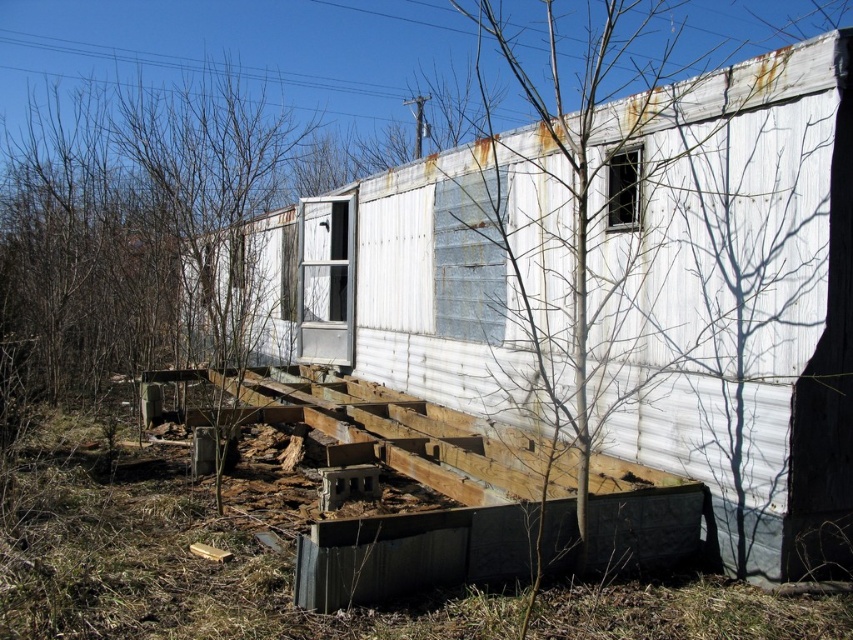
Is rusty corrugated metal shed at center above bare wood tree at center?

No.

Between point (540, 163) and point (485, 10), which one is positioned in front?

Positioned in front is point (485, 10).

Does point (430, 378) come farther from viewer compared to point (519, 282)?

Yes.

Locate an element on the screen. rusty corrugated metal shed at center is located at coordinates (732, 296).

Is metallic gray foundation at lower center positioned in front of bare wood tree at center?

No, it is behind bare wood tree at center.

Is point (437, 560) behind point (566, 128)?

No, it is in front of (566, 128).

Where is `metallic gray foundation at lower center`? The image size is (853, 640). metallic gray foundation at lower center is located at coordinates (413, 554).

Who is more forward, (686,404) or (531,541)?

Point (531,541) is in front.

Is rusty corrugated metal shed at center taller than metallic gray foundation at lower center?

Correct, rusty corrugated metal shed at center is much taller as metallic gray foundation at lower center.

Is point (643, 204) positioned behind point (370, 588)?

Yes, it is behind point (370, 588).

I want to click on rusty corrugated metal shed at center, so click(x=732, y=296).